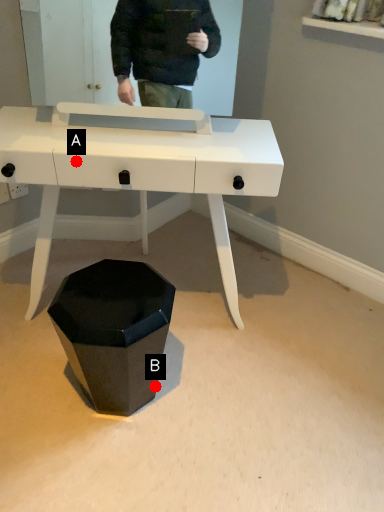
Question: Two points are circled on the image, labeled by A and B beside each circle. Which point appears closest to the camera in this image?

Choices:
 (A) A is closer
 (B) B is closer

Answer: (A)